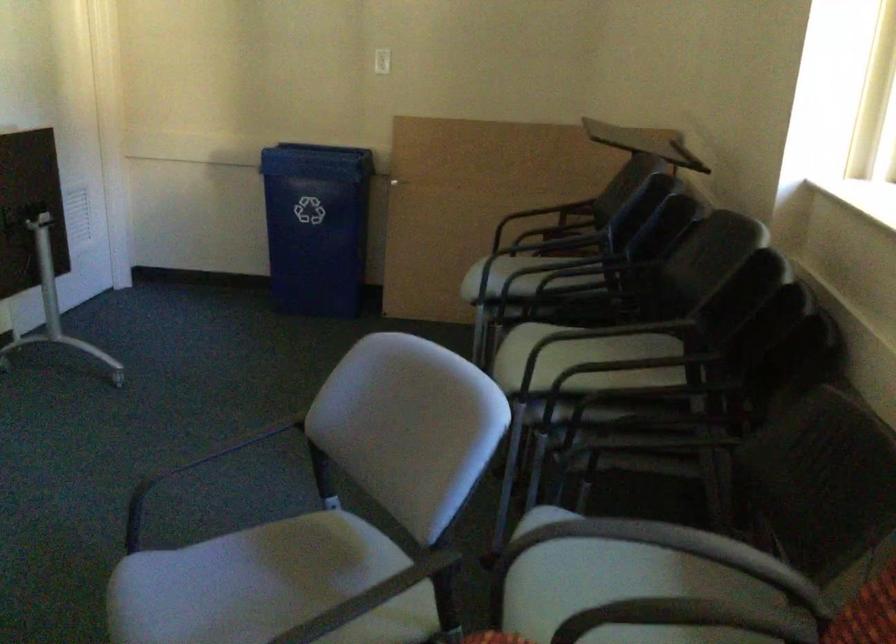
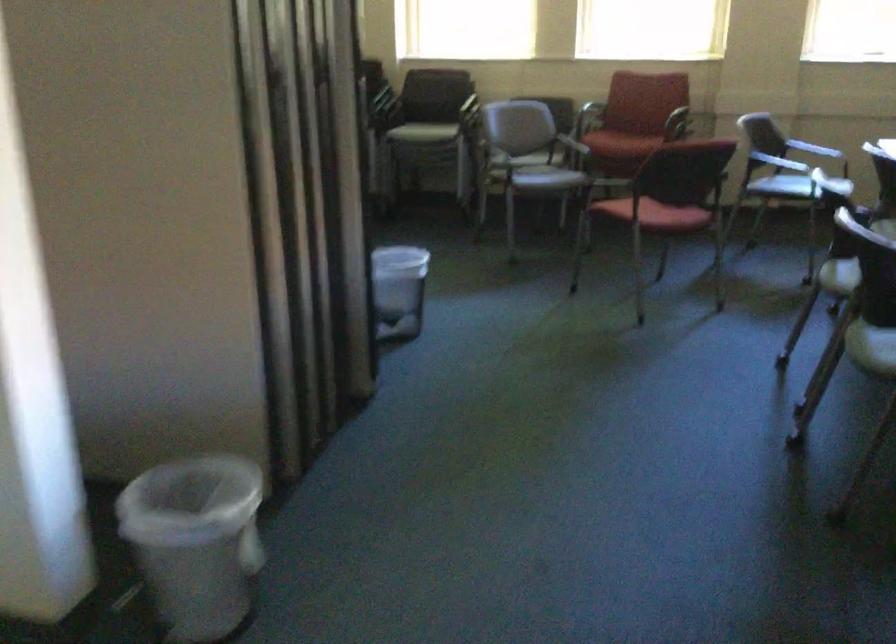
Question: I am providing you with two images of the same scene from different viewpoints. Which of the following objects are not visible in image2?

Choices:
 (A) chair sitting surface
 (B) silver soap pump
 (C) red chair sitting surface
 (D) chair armrest

Answer: (A)